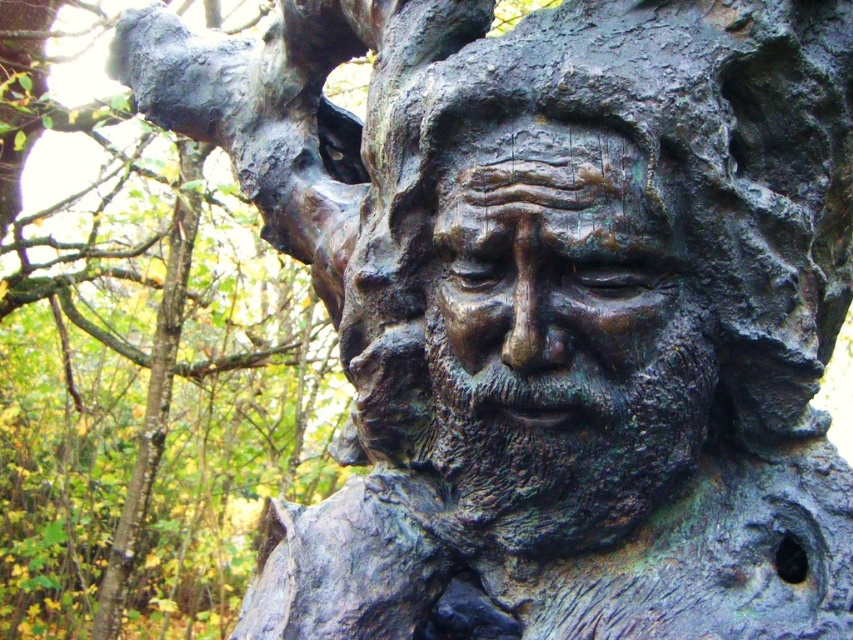
Question: Is bronze textured face at center smaller than green patina bark at upper right?

Choices:
 (A) no
 (B) yes

Answer: (B)

Question: Does bronze textured face at center appear on the left side of green patina bark at upper right?

Choices:
 (A) yes
 (B) no

Answer: (B)

Question: Can you confirm if bronze textured face at center is thinner than green patina bark at upper right?

Choices:
 (A) yes
 (B) no

Answer: (A)